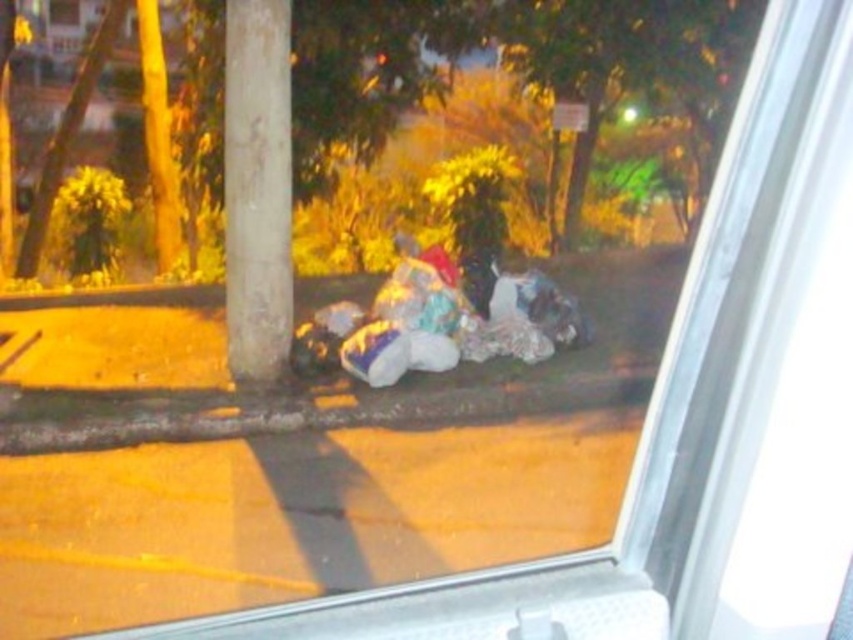
Question: Which point is closer to the camera?

Choices:
 (A) fuzzy fabric pile at center
 (B) white textured pole at center

Answer: (B)

Question: Does white textured pole at center appear on the right side of fuzzy fabric pile at center?

Choices:
 (A) no
 (B) yes

Answer: (A)

Question: Which object is closer to the camera taking this photo?

Choices:
 (A) white textured pole at center
 (B) fuzzy fabric pile at center

Answer: (A)

Question: Which of the following is the farthest from the observer?

Choices:
 (A) (257, 259)
 (B) (376, 310)

Answer: (B)

Question: Is green leafy tree at center behind fuzzy fabric pile at center?

Choices:
 (A) yes
 (B) no

Answer: (A)

Question: Does green leafy tree at center have a larger size compared to fuzzy fabric pile at center?

Choices:
 (A) no
 (B) yes

Answer: (A)